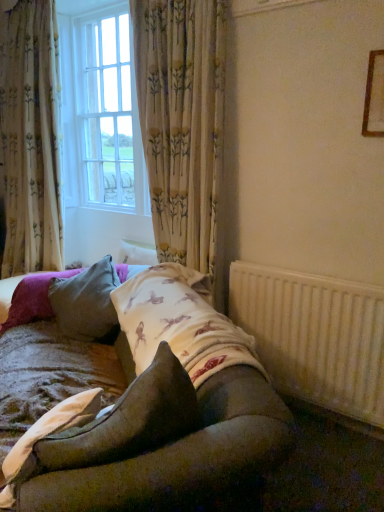
Question: In which direction should I rotate to look at floral fabric curtain at center, arranged as the first curtain when viewed from the right?

Choices:
 (A) left
 (B) right

Answer: (A)

Question: Should I look upward or downward to see textured beige quilt at lower left?

Choices:
 (A) up
 (B) down

Answer: (B)

Question: Is velvet brown pillow at center, arranged as the first pillow when viewed from the front, thinner than wooden frame at upper right?

Choices:
 (A) no
 (B) yes

Answer: (A)

Question: Is velvet brown pillow at center, the 2th pillow viewed from the back, at the right side of wooden frame at upper right?

Choices:
 (A) no
 (B) yes

Answer: (A)

Question: Is velvet brown pillow at center, arranged as the first pillow when viewed from the front, facing away from wooden frame at upper right?

Choices:
 (A) yes
 (B) no

Answer: (B)

Question: Does velvet brown pillow at center, the 2th pillow viewed from the back, have a greater height compared to wooden frame at upper right?

Choices:
 (A) no
 (B) yes

Answer: (A)

Question: From a real-world perspective, is velvet brown pillow at center, arranged as the first pillow when viewed from the front, under wooden frame at upper right?

Choices:
 (A) yes
 (B) no

Answer: (A)

Question: Is velvet brown pillow at center, the 2th pillow viewed from the back, shorter than wooden frame at upper right?

Choices:
 (A) yes
 (B) no

Answer: (A)

Question: From a real-world perspective, is white textured radiator at lower right located higher than velvet gray pillow at center, which ranks as the second pillow in front-to-back order?

Choices:
 (A) no
 (B) yes

Answer: (A)

Question: From the image's perspective, is white textured radiator at lower right under velvet gray pillow at center, which is the 1th pillow from back to front?

Choices:
 (A) no
 (B) yes

Answer: (B)

Question: Would you say white textured radiator at lower right is a long distance from velvet gray pillow at center, which is the 1th pillow from back to front?

Choices:
 (A) yes
 (B) no

Answer: (B)

Question: Considering the relative sizes of white textured radiator at lower right and velvet gray pillow at center, which ranks as the second pillow in front-to-back order, in the image provided, is white textured radiator at lower right taller than velvet gray pillow at center, which ranks as the second pillow in front-to-back order,?

Choices:
 (A) no
 (B) yes

Answer: (B)

Question: Is white textured radiator at lower right located outside velvet gray pillow at center, which ranks as the second pillow in front-to-back order?

Choices:
 (A) no
 (B) yes

Answer: (B)

Question: Does white textured radiator at lower right have a larger size compared to velvet gray pillow at center, which is the 1th pillow from back to front?

Choices:
 (A) no
 (B) yes

Answer: (A)

Question: Is white textured radiator at lower right closer to camera compared to wooden frame at upper right?

Choices:
 (A) no
 (B) yes

Answer: (A)